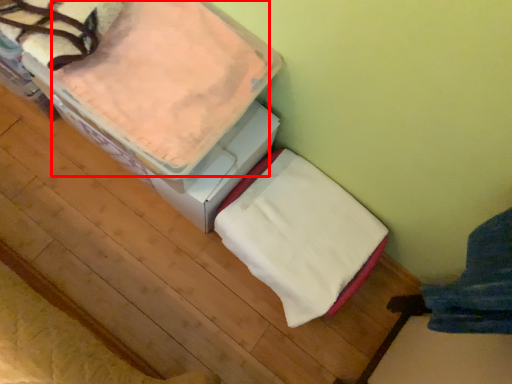
Question: From the image's perspective, where is sheet (annotated by the red box) located relative to blanket?

Choices:
 (A) above
 (B) below

Answer: (A)